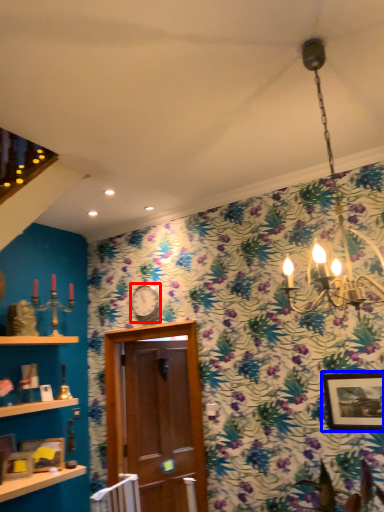
Question: Which object appears farthest to the camera in this image, clock (highlighted by a red box) or picture frame (highlighted by a blue box)?

Choices:
 (A) clock
 (B) picture frame

Answer: (A)